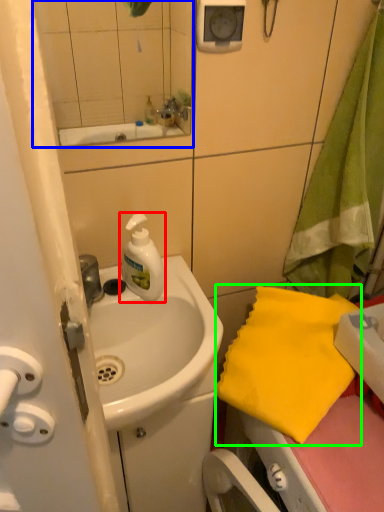
Question: Which object is the closest to the cleaning product (highlighted by a red box)? Choose among these: mirror (highlighted by a blue box) or beach towel (highlighted by a green box).

Choices:
 (A) mirror
 (B) beach towel

Answer: (A)